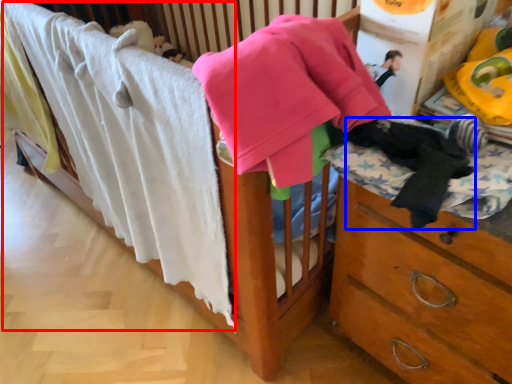
Question: Among these objects, which one is farthest to the camera, bath towel (highlighted by a red box) or clothing (highlighted by a blue box)?

Choices:
 (A) bath towel
 (B) clothing

Answer: (A)